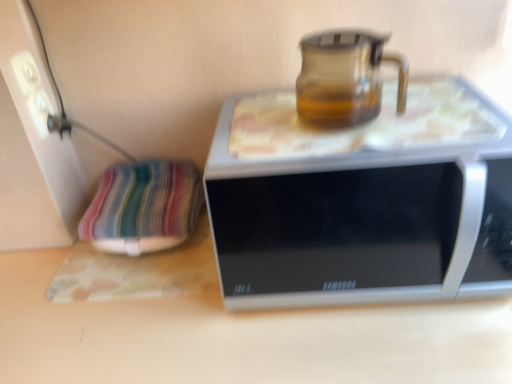
Identify the location of vacant area located to the right-hand side of transparent glass jug at upper center. (436, 115).